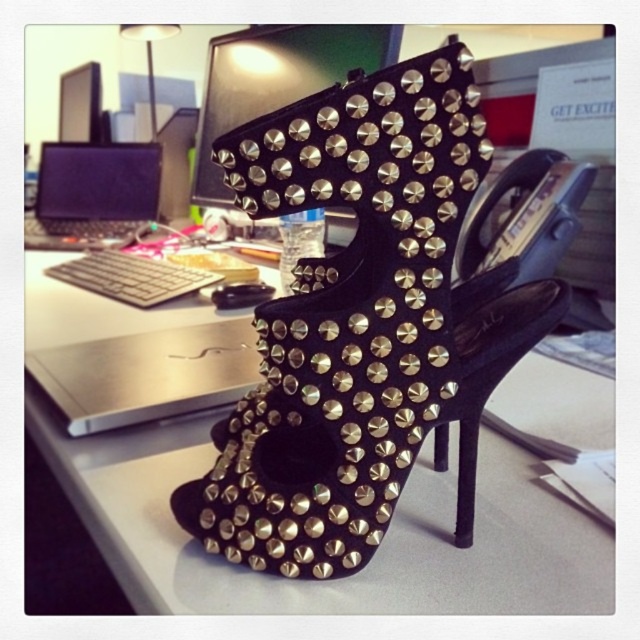
Question: Can you confirm if black suede studded sandal at center is smaller than black matte desk at center?

Choices:
 (A) no
 (B) yes

Answer: (B)

Question: Which object appears farthest from the camera in this image?

Choices:
 (A) black matte laptop at left
 (B) metallic studded shoe at upper center
 (C) black matte desk at center

Answer: (A)

Question: Is black matte desk at center above black matte laptop at left?

Choices:
 (A) no
 (B) yes

Answer: (A)

Question: Which point is closer to the camera?

Choices:
 (A) (61, 156)
 (B) (406, 340)
 (C) (140, 528)
 (D) (317, 45)

Answer: (B)

Question: Which point is closer to the camera?

Choices:
 (A) (200, 196)
 (B) (48, 212)
 (C) (352, 532)

Answer: (C)

Question: Can you confirm if black suede studded sandal at center is wider than metallic studded shoe at upper center?

Choices:
 (A) yes
 (B) no

Answer: (B)